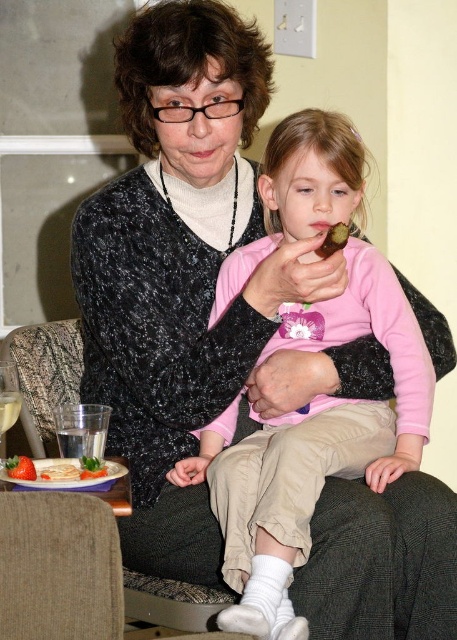
Question: Considering the real-world distances, which object is closest to the smooth white plate at lower left?

Choices:
 (A) smooth red strawberry at lower left
 (B) chocolate cake at center
 (C) green leafy vegetable at lower left
 (D) pink matte/polyester shirt at center

Answer: (C)

Question: Estimate the real-world distances between objects in this image. Which object is farther from the chocolate cake at center?

Choices:
 (A) smooth white plate at lower left
 (B) smooth red strawberry at lower left

Answer: (B)

Question: Which point is closer to the camera?

Choices:
 (A) (91, 461)
 (B) (344, 243)

Answer: (A)

Question: Observing the image, what is the correct spatial positioning of chocolate cake at center in reference to green leafy vegetable at lower left?

Choices:
 (A) left
 (B) right

Answer: (B)

Question: Is pink matte/polyester shirt at center to the right of smooth red strawberry at lower left from the viewer's perspective?

Choices:
 (A) yes
 (B) no

Answer: (A)

Question: Is chocolate cake at center thinner than smooth white plate at lower left?

Choices:
 (A) no
 (B) yes

Answer: (B)